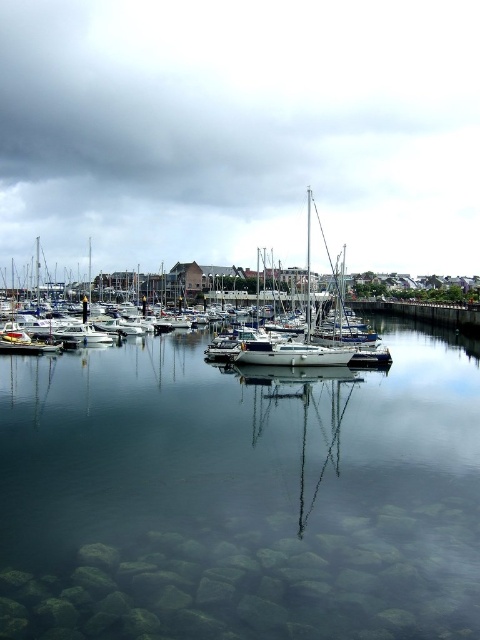
Question: In this image, where is clear glass water at center located relative to white glossy sailboat at center?

Choices:
 (A) left
 (B) right

Answer: (A)

Question: Which of the following is the closest to the observer?

Choices:
 (A) matte white boats at center
 (B) white glossy sailboat at center

Answer: (B)

Question: Is matte white boats at center above white glossy sailboat at center?

Choices:
 (A) no
 (B) yes

Answer: (B)

Question: Which object is farther from the camera taking this photo?

Choices:
 (A) white glossy sailboat at center
 (B) matte white boats at center
 (C) clear glass water at center

Answer: (B)

Question: Does matte white boats at center appear on the left side of white glossy sailboat at center?

Choices:
 (A) no
 (B) yes

Answer: (A)

Question: Based on their relative distances, which object is farther from the white glossy sailboat at center?

Choices:
 (A) clear glass water at center
 (B) matte white boats at center

Answer: (B)